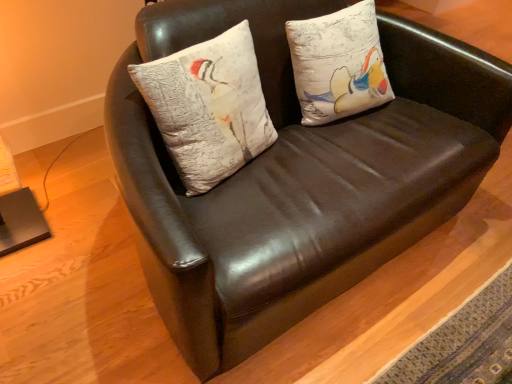
The width and height of the screenshot is (512, 384). In order to click on silky white pillow with bird design at upper center in this screenshot , I will do `click(208, 107)`.

What do you see at coordinates (208, 107) in the screenshot? The image size is (512, 384). I see `silky white pillow with bird design at upper center` at bounding box center [208, 107].

Find the location of a particular element. The height and width of the screenshot is (384, 512). silky white pillow with bird design at upper center is located at coordinates (208, 107).